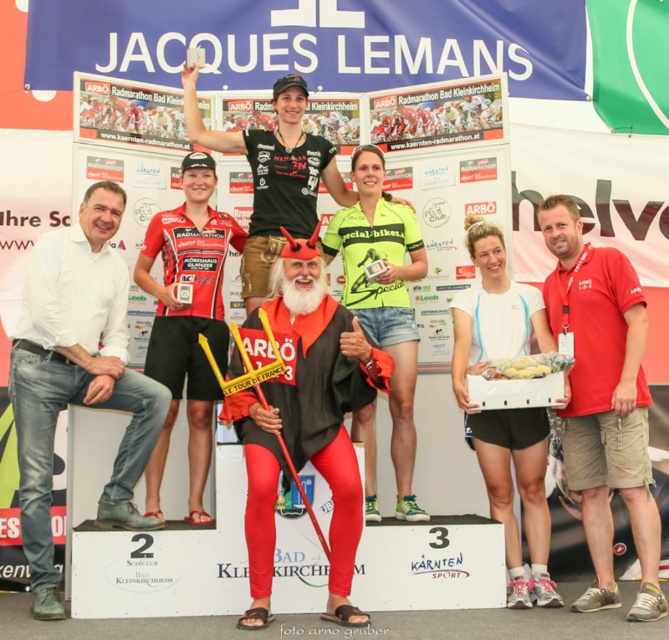
In the scene shown: Who is higher up, red fabric skier at center or black matte jersey at center?

black matte jersey at center

Image resolution: width=669 pixels, height=640 pixels. What do you see at coordinates (187, 321) in the screenshot?
I see `red fabric skier at center` at bounding box center [187, 321].

Looking at this image, who is more forward, (155, 481) or (284, 188)?

Point (155, 481) is in front.

The width and height of the screenshot is (669, 640). I want to click on red fabric skier at center, so click(x=187, y=321).

Describe the element at coordinates (603, 401) in the screenshot. I see `red cotton shirt at right` at that location.

Does point (583, 436) come closer to viewer compared to point (153, 232)?

Yes, point (583, 436) is closer to viewer.

In order to click on red cotton shirt at right in this screenshot , I will do `click(603, 401)`.

Does point (304, 301) come behind point (638, 419)?

Yes, point (304, 301) is farther from viewer.

Can you confirm if red matte devil costume at center is positioned below red cotton shirt at right?

Yes, red matte devil costume at center is below red cotton shirt at right.

Does point (292, 456) lie behind point (603, 385)?

No, it is in front of (603, 385).

I want to click on red matte devil costume at center, so click(304, 420).